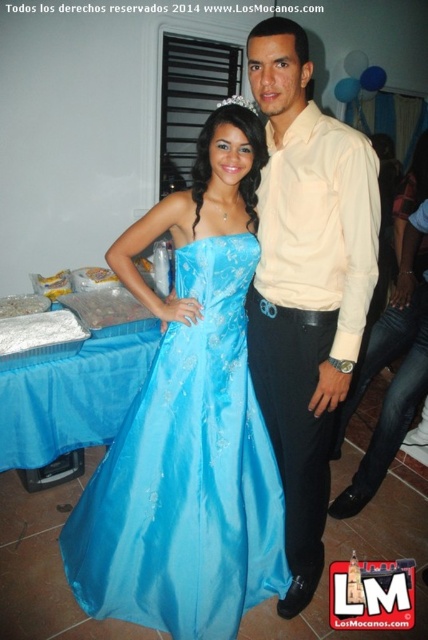
Question: Among these points, which one is farthest from the camera?

Choices:
 (A) (199, 483)
 (B) (303, 448)

Answer: (B)

Question: Where is shiny blue gown at center located in relation to matte beige shirt at center in the image?

Choices:
 (A) right
 (B) left

Answer: (B)

Question: Can you confirm if shiny blue gown at center is bigger than matte beige shirt at center?

Choices:
 (A) yes
 (B) no

Answer: (A)

Question: Does shiny blue gown at center appear under matte beige shirt at center?

Choices:
 (A) yes
 (B) no

Answer: (A)